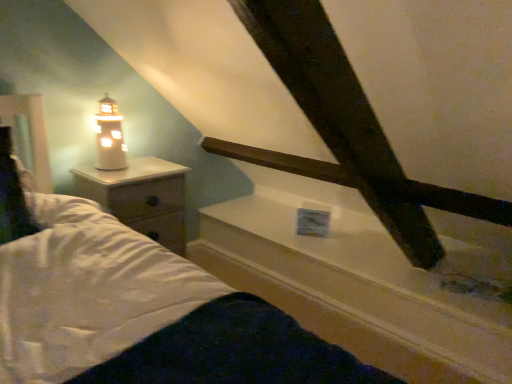
Question: Is white wood nightstand at left oriented away from white ceramic lighthouse at left?

Choices:
 (A) yes
 (B) no

Answer: (B)

Question: Does white wood nightstand at left have a greater height compared to white ceramic lighthouse at left?

Choices:
 (A) no
 (B) yes

Answer: (B)

Question: Can you confirm if white wood nightstand at left is positioned to the left of white ceramic lighthouse at left?

Choices:
 (A) no
 (B) yes

Answer: (A)

Question: Does white wood nightstand at left touch white ceramic lighthouse at left?

Choices:
 (A) yes
 (B) no

Answer: (B)

Question: Does white wood nightstand at left contain white ceramic lighthouse at left?

Choices:
 (A) yes
 (B) no

Answer: (B)

Question: Is white wood nightstand at left in front of white ceramic lighthouse at left?

Choices:
 (A) yes
 (B) no

Answer: (A)

Question: From the image's perspective, is white glossy window sill at upper center below white ceramic lighthouse at left?

Choices:
 (A) yes
 (B) no

Answer: (A)

Question: Is white glossy window sill at upper center thinner than white ceramic lighthouse at left?

Choices:
 (A) no
 (B) yes

Answer: (A)

Question: Can white ceramic lighthouse at left be found inside white glossy window sill at upper center?

Choices:
 (A) no
 (B) yes

Answer: (A)

Question: Considering the relative positions of white glossy window sill at upper center and white ceramic lighthouse at left in the image provided, is white glossy window sill at upper center behind white ceramic lighthouse at left?

Choices:
 (A) no
 (B) yes

Answer: (A)

Question: Can you confirm if white glossy window sill at upper center is positioned to the right of white ceramic lighthouse at left?

Choices:
 (A) yes
 (B) no

Answer: (A)

Question: Does white glossy window sill at upper center have a greater height compared to white ceramic lighthouse at left?

Choices:
 (A) yes
 (B) no

Answer: (B)

Question: Could you tell me if white ceramic lighthouse at left is turned towards white glossy window sill at upper center?

Choices:
 (A) yes
 (B) no

Answer: (B)